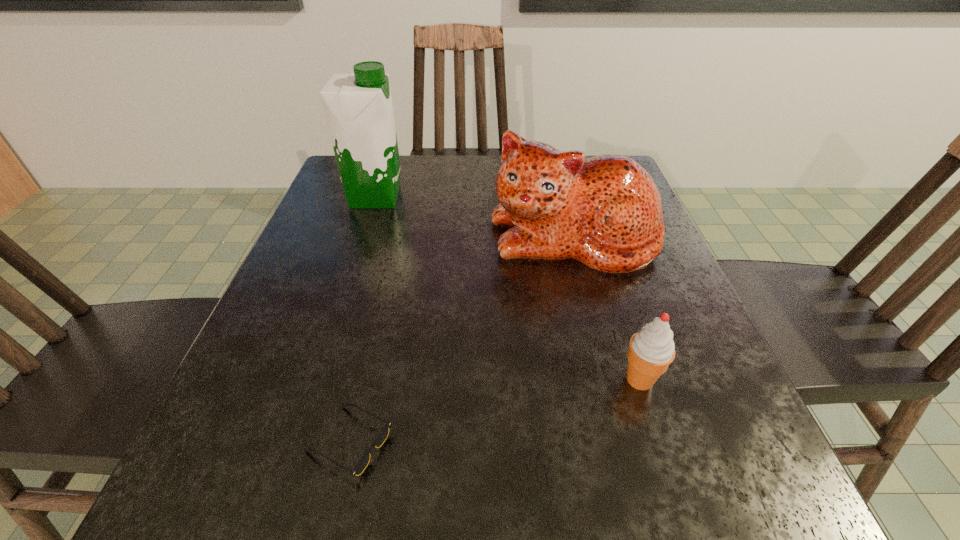
The height and width of the screenshot is (540, 960). I want to click on vacant space at the left edge, so click(260, 421).

Where is `free region at the right edge of the desktop`? free region at the right edge of the desktop is located at coordinates (636, 299).

This screenshot has height=540, width=960. I want to click on empty space between the tallest object and the cat, so click(x=474, y=217).

Locate an element on the screen. free space that is in between the sunglasses and the soya milk is located at coordinates (363, 320).

You are a GUI agent. You are given a task and a screenshot of the screen. Output one action in this format:
    pyautogui.click(x=<x>, y=<y>)
    Task: Click on the free space between the second nearest object and the sunglasses
    
    Given the screenshot: What is the action you would take?
    pyautogui.click(x=494, y=411)

Image resolution: width=960 pixels, height=540 pixels. What are the coordinates of `vacant space that's between the tallest object and the second shortest object` in the screenshot? It's located at (508, 288).

Locate an element on the screen. blank region between the cat and the third farthest object is located at coordinates (607, 308).

Locate an element on the screen. free point between the third shortest object and the third farthest object is located at coordinates (607, 308).

You are a GUI agent. You are given a task and a screenshot of the screen. Output one action in this format:
    pyautogui.click(x=<x>, y=<y>)
    Task: Click on the free area in between the second shortest object and the sunglasses
    The height and width of the screenshot is (540, 960).
    Given the screenshot: What is the action you would take?
    pyautogui.click(x=494, y=411)

This screenshot has width=960, height=540. Find the location of `unoccupied area between the tallest object and the shortest object`. unoccupied area between the tallest object and the shortest object is located at coordinates (363, 320).